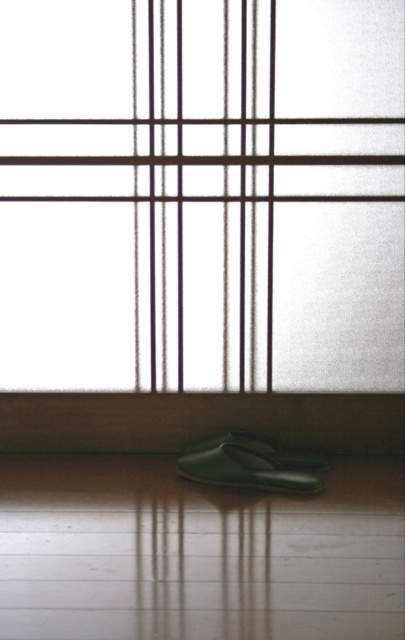
Question: Based on their relative distances, which object is farther from the green matte slipper at lower center?

Choices:
 (A) frosted glass window at center
 (B) green matte shoe at lower center

Answer: (A)

Question: Considering the relative positions of frosted glass window at center and green matte shoe at lower center in the image provided, where is frosted glass window at center located with respect to green matte shoe at lower center?

Choices:
 (A) left
 (B) right

Answer: (A)

Question: Among these points, which one is farthest from the camera?

Choices:
 (A) (219, 483)
 (B) (106, 260)
 (C) (253, 448)

Answer: (B)

Question: In this image, where is frosted glass window at center located relative to green matte slipper at lower center?

Choices:
 (A) right
 (B) left

Answer: (B)

Question: Which object is farther from the camera taking this photo?

Choices:
 (A) green matte slipper at lower center
 (B) frosted glass window at center
 (C) green matte shoe at lower center

Answer: (B)

Question: Is green matte slipper at lower center in front of green matte shoe at lower center?

Choices:
 (A) no
 (B) yes

Answer: (B)